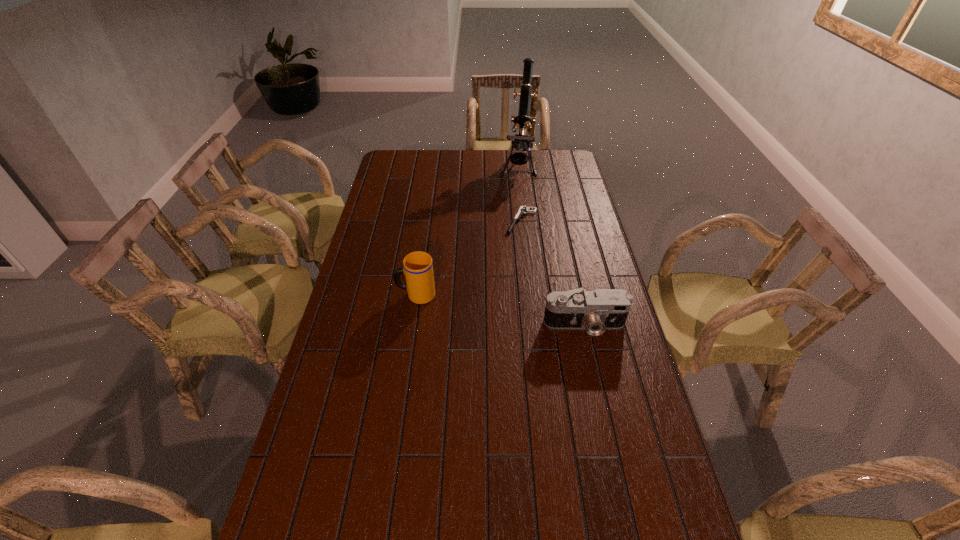
Locate an element on the screen. Image resolution: width=960 pixels, height=540 pixels. free space on the desktop that is between the third shortest object and the camera and is positioned on the front-facing side of the pistol is located at coordinates (477, 306).

Identify the location of vacant space on the desktop that is between the second tallest object and the third tallest object and is positioned through the eyepiece of the tallest object. Image resolution: width=960 pixels, height=540 pixels. (492, 309).